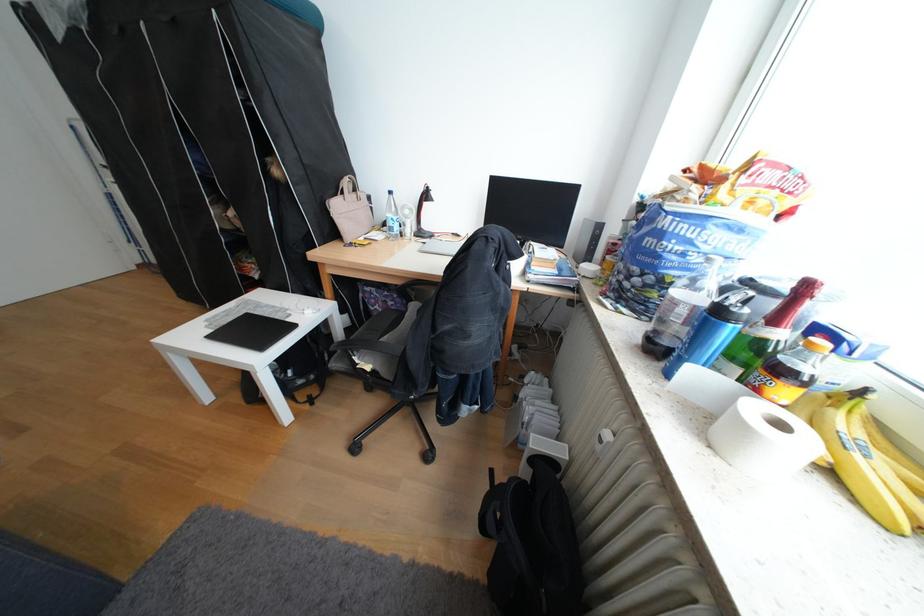
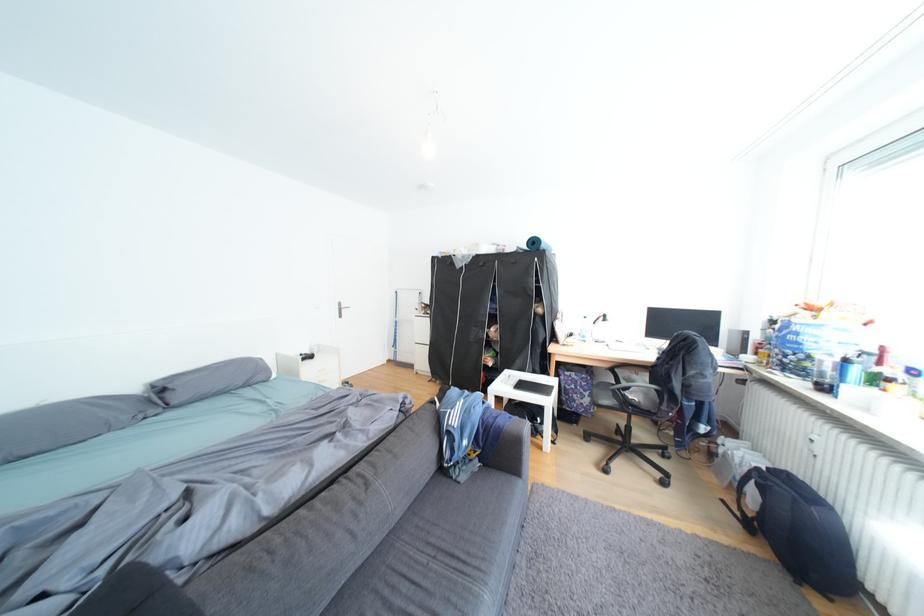
The point at [505,472] is marked in the first image. Where is the corresponding point in the second image?

(736, 501)